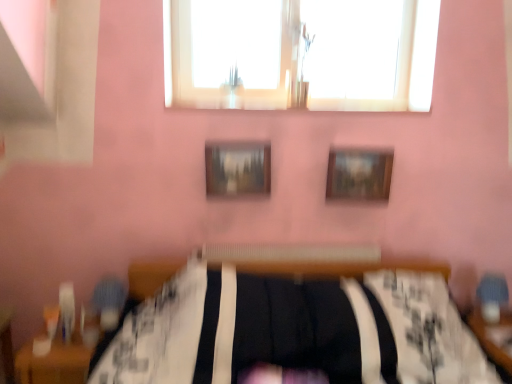
Question: Is transparent glass window at upper center positioned with its back to wooden textured picture frame at center, positioned as the first picture frame in left-to-right order?

Choices:
 (A) yes
 (B) no

Answer: (B)

Question: Is transparent glass window at upper center thinner than wooden textured picture frame at center, acting as the second picture frame starting from the right?

Choices:
 (A) no
 (B) yes

Answer: (A)

Question: From the image's perspective, is transparent glass window at upper center on top of wooden textured picture frame at center, positioned as the first picture frame in left-to-right order?

Choices:
 (A) yes
 (B) no

Answer: (A)

Question: Is transparent glass window at upper center not close to wooden textured picture frame at center, acting as the second picture frame starting from the right?

Choices:
 (A) no
 (B) yes

Answer: (A)

Question: Does transparent glass window at upper center have a greater height compared to wooden textured picture frame at center, acting as the second picture frame starting from the right?

Choices:
 (A) yes
 (B) no

Answer: (A)

Question: Considering the positions of wooden table at lower left, positioned as the 2th table in right-to-left order, and wooden textured picture frame at center, positioned as the first picture frame in left-to-right order, in the image, is wooden table at lower left, positioned as the 2th table in right-to-left order, taller or shorter than wooden textured picture frame at center, positioned as the first picture frame in left-to-right order,?

Choices:
 (A) short
 (B) tall

Answer: (B)

Question: Considering the positions of wooden table at lower left, positioned as the 1th table in left-to-right order, and wooden textured picture frame at center, positioned as the first picture frame in left-to-right order, in the image, is wooden table at lower left, positioned as the 1th table in left-to-right order, bigger or smaller than wooden textured picture frame at center, positioned as the first picture frame in left-to-right order,?

Choices:
 (A) small
 (B) big

Answer: (B)

Question: Considering the positions of wooden table at lower left, positioned as the 1th table in left-to-right order, and wooden textured picture frame at center, acting as the second picture frame starting from the right, in the image, is wooden table at lower left, positioned as the 1th table in left-to-right order, wider or thinner than wooden textured picture frame at center, acting as the second picture frame starting from the right,?

Choices:
 (A) wide
 (B) thin

Answer: (A)

Question: Considering the positions of point (20, 379) and point (245, 168), is point (20, 379) closer or farther from the camera than point (245, 168)?

Choices:
 (A) closer
 (B) farther

Answer: (A)

Question: Choose the correct answer: Is transparent glass window at upper center inside wooden textured picture frame at center, acting as the second picture frame starting from the right, or outside it?

Choices:
 (A) inside
 (B) outside

Answer: (B)

Question: Would you say transparent glass window at upper center is to the left or to the right of wooden textured picture frame at center, positioned as the first picture frame in left-to-right order, in the picture?

Choices:
 (A) left
 (B) right

Answer: (B)

Question: Considering the positions of point (396, 69) and point (247, 182), is point (396, 69) closer or farther from the camera than point (247, 182)?

Choices:
 (A) farther
 (B) closer

Answer: (A)

Question: From the image's perspective, is transparent glass window at upper center located above or below wooden textured picture frame at center, acting as the second picture frame starting from the right?

Choices:
 (A) below
 (B) above

Answer: (B)

Question: From a real-world perspective, relative to wooden table at lower left, positioned as the 2th table in right-to-left order, is wooden table at lower right, placed as the 1th table when sorted from right to left, vertically above or below?

Choices:
 (A) below
 (B) above

Answer: (A)

Question: In terms of width, does wooden table at lower right, the 2th table from the left, look wider or thinner when compared to wooden table at lower left, positioned as the 1th table in left-to-right order?

Choices:
 (A) wide
 (B) thin

Answer: (B)